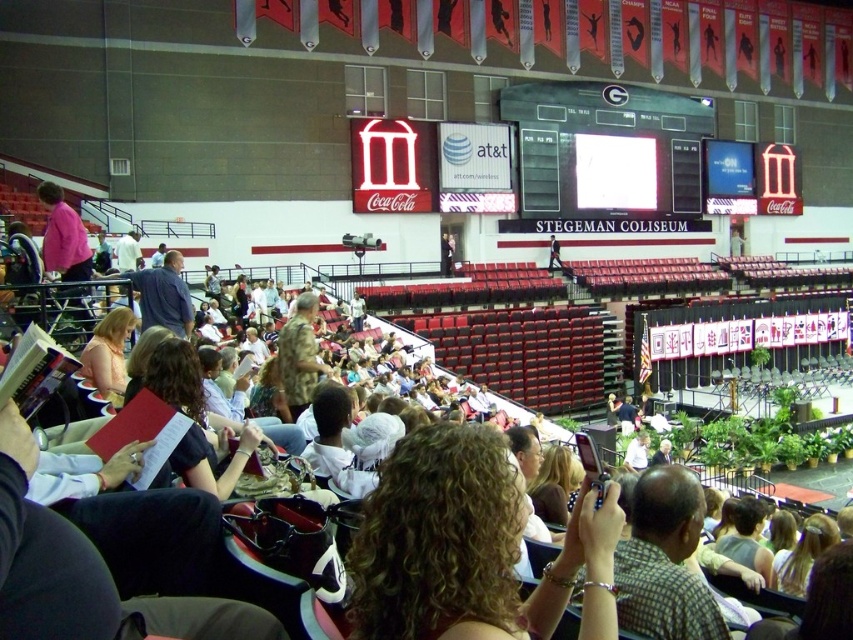
Based on the photo, is black glossy scoreboard at center further to the viewer compared to camouflage uniform at center?

That is True.

Consider the image. Between black glossy scoreboard at center and camouflage uniform at center, which one appears on the left side from the viewer's perspective?

camouflage uniform at center is more to the left.

Which is behind, point (672, 154) or point (302, 387)?

Point (672, 154)

Image resolution: width=853 pixels, height=640 pixels. Identify the location of black glossy scoreboard at center. 608,150.

Which is more to the right, curly hair at center or camouflage uniform at center?

Positioned to the right is curly hair at center.

Consider the image. Which is above, curly hair at center or camouflage uniform at center?

camouflage uniform at center is above.

This screenshot has height=640, width=853. What are the coordinates of `curly hair at center` in the screenshot? It's located at (469, 547).

Which is more to the left, curly hair at center or black glossy scoreboard at center?

From the viewer's perspective, curly hair at center appears more on the left side.

Measure the distance between point (x=426, y=525) and camera.

The distance of point (x=426, y=525) from camera is 52.92 feet.

Describe the element at coordinates (469, 547) in the screenshot. I see `curly hair at center` at that location.

What are the coordinates of `curly hair at center` in the screenshot? It's located at click(469, 547).